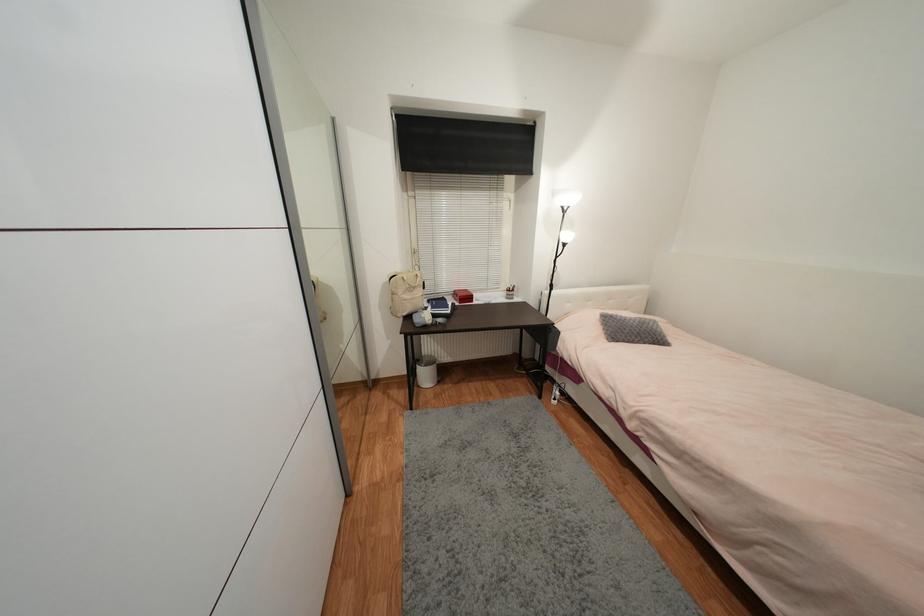
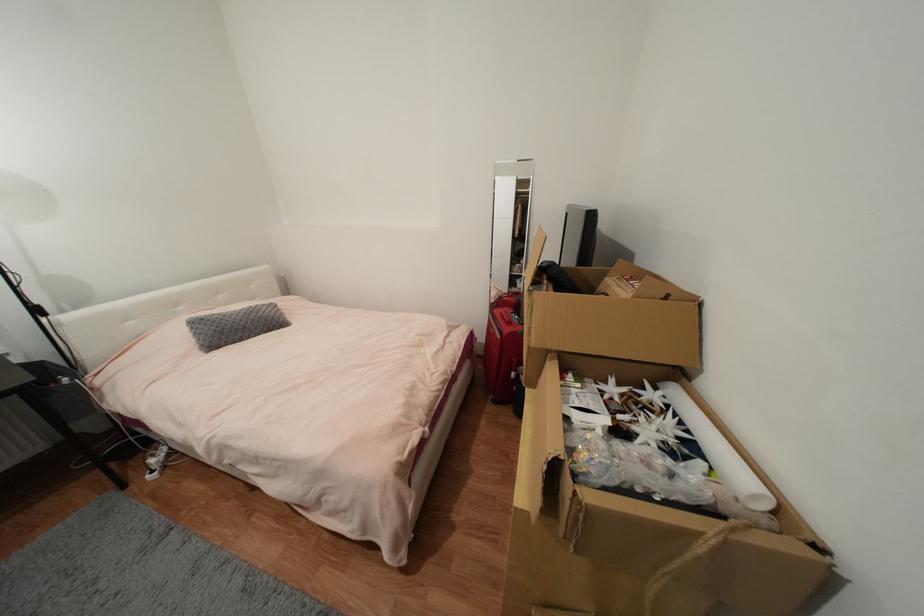
The point at (639, 326) is marked in the first image. Where is the corresponding point in the second image?

(244, 320)